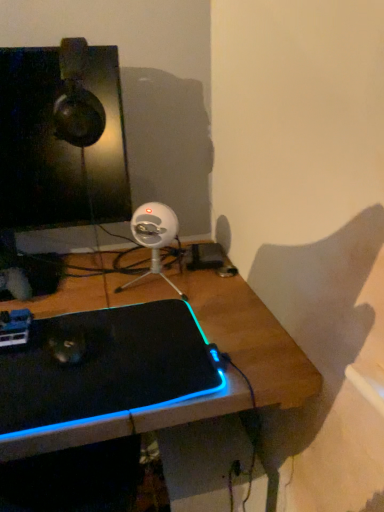
The image size is (384, 512). I want to click on black matte laptop at center, so click(x=105, y=367).

Find the location of a particular element. black matte laptop at center is located at coordinates (105, 367).

Relative to black matte laptop at center, is white plastic webcam at center in front or behind?

Visually, white plastic webcam at center is located behind black matte laptop at center.

Does white plastic webcam at center have a smaller size compared to black matte laptop at center?

Yes, white plastic webcam at center is smaller than black matte laptop at center.

Considering the sizes of white plastic webcam at center and black matte laptop at center in the image, is white plastic webcam at center wider or thinner than black matte laptop at center?

In the image, white plastic webcam at center appears to be more narrow than black matte laptop at center.

From the image's perspective, which one is positioned higher, white plastic webcam at center or black matte laptop at center?

white plastic webcam at center appears higher in the image.

Which is more to the right, white plastic webcam at center or matte black monitor at upper left?

From the viewer's perspective, white plastic webcam at center appears more on the right side.

From a real-world perspective, between white plastic webcam at center and matte black monitor at upper left, who is vertically lower?

white plastic webcam at center.

From the image's perspective, who appears lower, white plastic webcam at center or matte black monitor at upper left?

white plastic webcam at center is shown below in the image.

Which is closer to the camera, (145, 212) or (85, 109)?

Point (145, 212).

Which object is closer to the camera, black matte laptop at center or white plastic webcam at center?

black matte laptop at center.

What's the angular difference between black matte laptop at center and white plastic webcam at center's facing directions?

0.000715 degrees separate the facing orientations of black matte laptop at center and white plastic webcam at center.

Is black matte laptop at center inside the boundaries of white plastic webcam at center, or outside?

The correct answer is: outside.

The width and height of the screenshot is (384, 512). Find the location of `fan lying on the right of black matte laptop at center`. fan lying on the right of black matte laptop at center is located at coordinates (154, 237).

Is black matte laptop at center located outside matte black monitor at upper left?

Yes, black matte laptop at center is located beyond the bounds of matte black monitor at upper left.

Is black matte laptop at center looking in the opposite direction of matte black monitor at upper left?

Absolutely, black matte laptop at center is directed away from matte black monitor at upper left.

How much distance is there between black matte laptop at center and matte black monitor at upper left?

black matte laptop at center and matte black monitor at upper left are 14.65 inches apart from each other.

From a real-world perspective, is black matte laptop at center located beneath matte black monitor at upper left?

Yes.

Image resolution: width=384 pixels, height=512 pixels. In order to click on laptop on the right of matte black monitor at upper left in this screenshot , I will do `click(105, 367)`.

From the image's perspective, is matte black monitor at upper left located above black matte laptop at center?

Yes, from the image's perspective, matte black monitor at upper left is above black matte laptop at center.

Is black matte laptop at center at the back of matte black monitor at upper left?

No, matte black monitor at upper left is not facing the opposite direction of black matte laptop at center.

Is matte black monitor at upper left smaller than white plastic webcam at center?

Actually, matte black monitor at upper left might be larger than white plastic webcam at center.

From the image's perspective, between matte black monitor at upper left and white plastic webcam at center, which one is located above?

matte black monitor at upper left.

From the picture: Is the surface of matte black monitor at upper left in direct contact with white plastic webcam at center?

matte black monitor at upper left is not next to white plastic webcam at center, and they're not touching.

The image size is (384, 512). I want to click on fan to the right of matte black monitor at upper left, so click(154, 237).

At what (x,y) coordinates should I click in order to perform the action: click on fan above the black matte laptop at center (from the image's perspective). Please return your answer as a coordinate pair (x, y). The height and width of the screenshot is (512, 384). Looking at the image, I should click on (154, 237).

Locate an element on the screen. This screenshot has width=384, height=512. computer monitor above the white plastic webcam at center (from a real-world perspective) is located at coordinates (62, 137).

Considering their positions, is black matte laptop at center positioned further to white plastic webcam at center than matte black monitor at upper left?

black matte laptop at center.

From the image, which object appears to be nearer to matte black monitor at upper left, black matte laptop at center or white plastic webcam at center?

white plastic webcam at center lies closer to matte black monitor at upper left than the other object.

Looking at the image, which one is located further to matte black monitor at upper left, white plastic webcam at center or black matte laptop at center?

black matte laptop at center is further to matte black monitor at upper left.

When comparing their distances from white plastic webcam at center, does matte black monitor at upper left or black matte laptop at center seem closer?

matte black monitor at upper left.

Based on their spatial positions, is white plastic webcam at center or matte black monitor at upper left further from black matte laptop at center?

The object further to black matte laptop at center is matte black monitor at upper left.

Based on their spatial positions, is matte black monitor at upper left or white plastic webcam at center closer to black matte laptop at center?

Among the two, white plastic webcam at center is located nearer to black matte laptop at center.

Identify the location of fan between matte black monitor at upper left and black matte laptop at center from top to bottom. (154, 237).